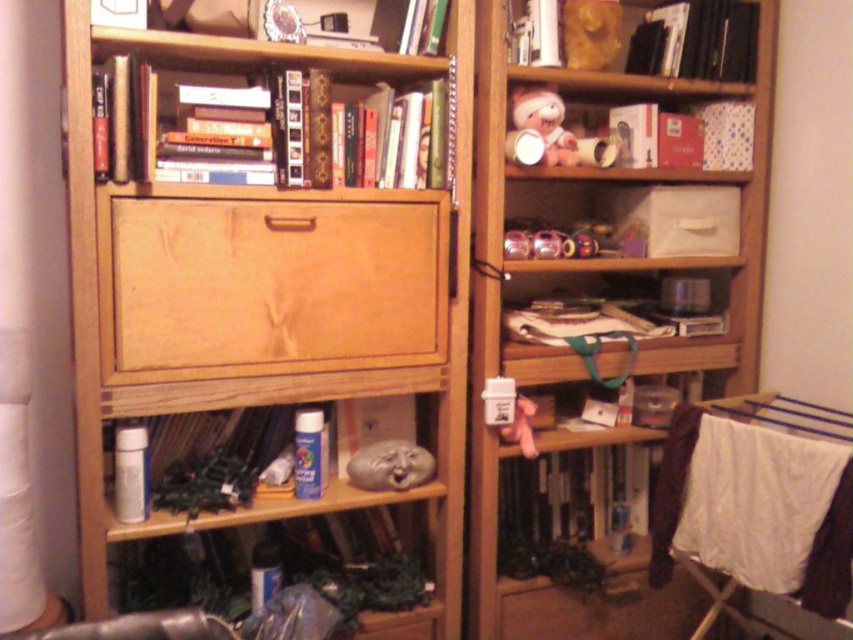
Question: Can you confirm if hardcover book at center is positioned to the left of gold metallic mask at upper center?

Choices:
 (A) yes
 (B) no

Answer: (B)

Question: Does black hardcover book at upper right have a larger size compared to matte plastic teddy bear at upper center?

Choices:
 (A) no
 (B) yes

Answer: (B)

Question: Which object appears closest to the camera in this image?

Choices:
 (A) matte plastic teddy bear at upper center
 (B) gold metallic mask at upper center

Answer: (A)

Question: Which of these objects is positioned closest to the matte plastic teddy bear at upper center?

Choices:
 (A) wooden bookcase at upper center
 (B) wooden drawer at center

Answer: (A)

Question: Which object is positioned closest to the matte cardboard box at upper center?

Choices:
 (A) hardcover book at upper center
 (B) wooden drawer at center

Answer: (A)

Question: Where is wooden bookcase at upper center located in relation to wooden drawer at center in the image?

Choices:
 (A) below
 (B) above

Answer: (A)